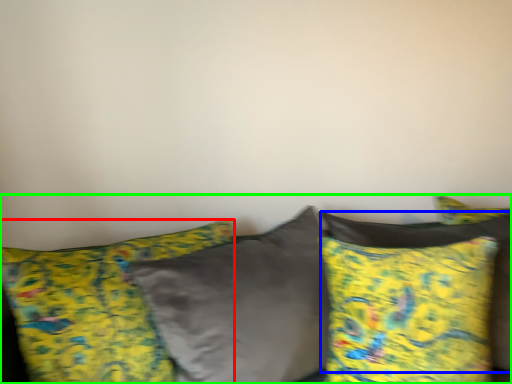
Question: Which is nearer to the pillow (highlighted by a red box)? pillow (highlighted by a blue box) or studio couch (highlighted by a green box).

Choices:
 (A) pillow
 (B) studio couch

Answer: (B)